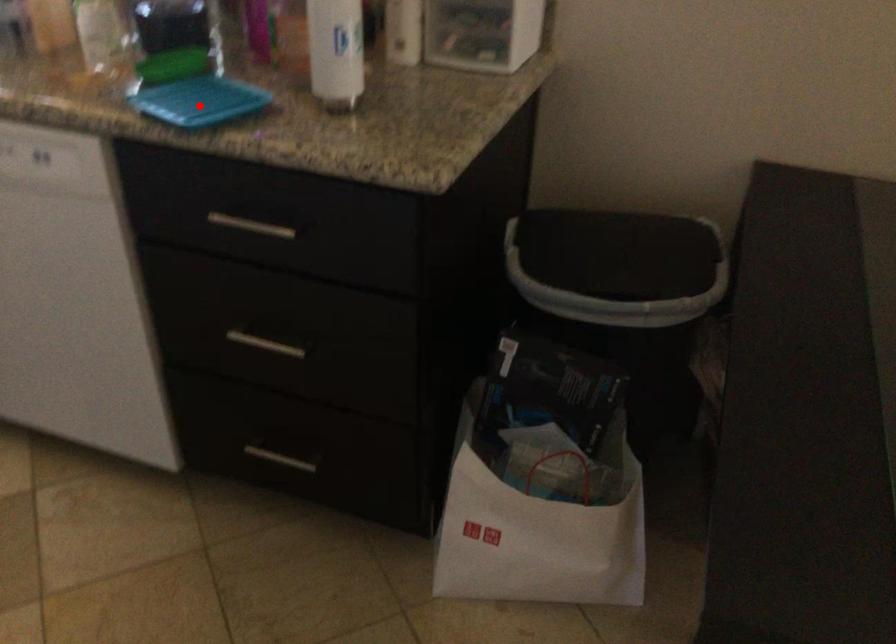
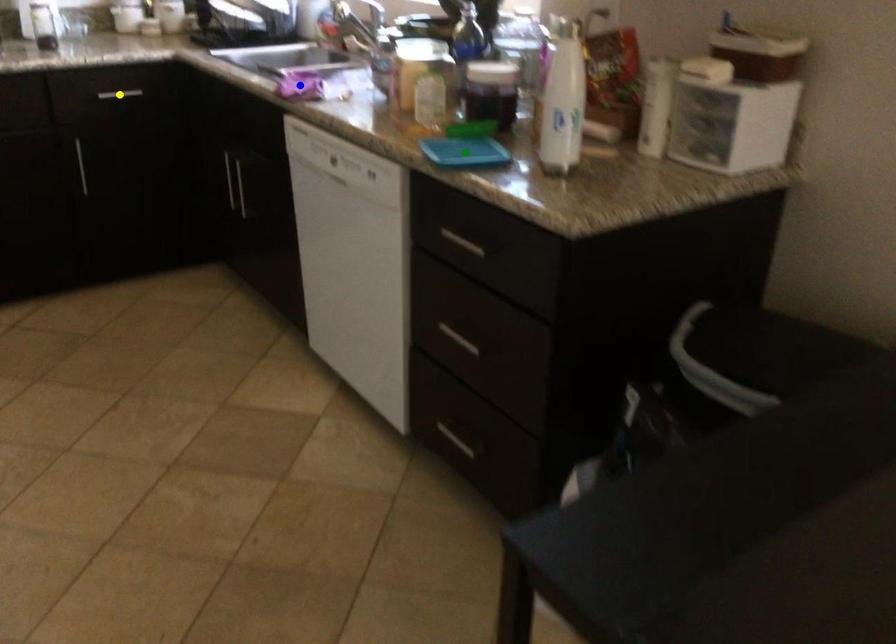
Question: I am providing you with two images of the same scene from different viewpoints. A red point is marked on the first image. You are given multiple points on the second image. Can you choose the point in image 2 that corresponds to the point in image 1?

Choices:
 (A) yellow point
 (B) green point
 (C) blue point

Answer: (B)